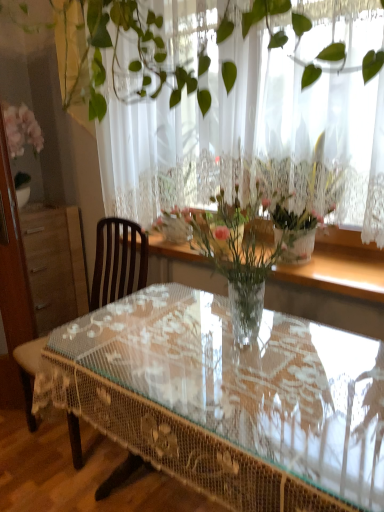
Question: Can you confirm if clear glass table at center is taller than white lace curtain at upper center?

Choices:
 (A) yes
 (B) no

Answer: (B)

Question: Is clear glass table at center smaller than white lace curtain at upper center?

Choices:
 (A) no
 (B) yes

Answer: (A)

Question: Can you confirm if clear glass table at center is shorter than white lace curtain at upper center?

Choices:
 (A) no
 (B) yes

Answer: (B)

Question: Does clear glass table at center turn towards white lace curtain at upper center?

Choices:
 (A) yes
 (B) no

Answer: (B)

Question: Is white lace curtain at upper center surrounded by clear glass table at center?

Choices:
 (A) no
 (B) yes

Answer: (A)

Question: Is clear glass table at center facing away from white lace curtain at upper center?

Choices:
 (A) no
 (B) yes

Answer: (A)

Question: From the image's perspective, is brown wooden chair at left above clear glass vase at center?

Choices:
 (A) yes
 (B) no

Answer: (B)

Question: Is clear glass vase at center surrounded by brown wooden chair at left?

Choices:
 (A) yes
 (B) no

Answer: (B)

Question: From a real-world perspective, is brown wooden chair at left on clear glass vase at center?

Choices:
 (A) yes
 (B) no

Answer: (B)

Question: Can you confirm if brown wooden chair at left is shorter than clear glass vase at center?

Choices:
 (A) yes
 (B) no

Answer: (B)

Question: Is brown wooden chair at left touching clear glass vase at center?

Choices:
 (A) yes
 (B) no

Answer: (B)

Question: Is brown wooden chair at left to the right of clear glass vase at center from the viewer's perspective?

Choices:
 (A) yes
 (B) no

Answer: (B)

Question: Considering the relative sizes of brown wooden chair at left and white lace curtain at upper center in the image provided, is brown wooden chair at left smaller than white lace curtain at upper center?

Choices:
 (A) yes
 (B) no

Answer: (A)